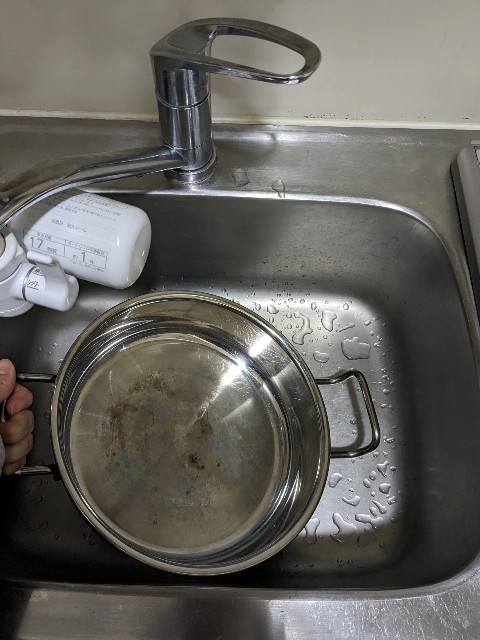
Identify the location of handle. The height and width of the screenshot is (640, 480). (34, 468), (377, 429).